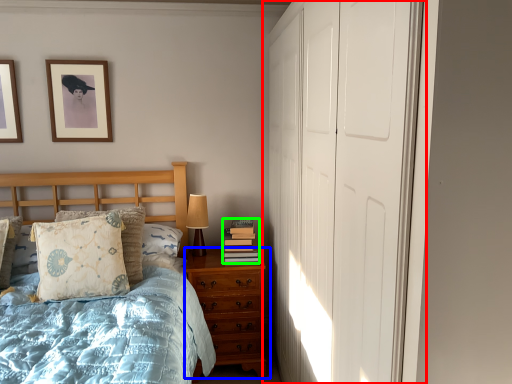
Question: Estimate the real-world distances between objects in this image. Which object is closer to door (highlighted by a red box), chest of drawers (highlighted by a blue box) or book (highlighted by a green box)?

Choices:
 (A) chest of drawers
 (B) book

Answer: (A)